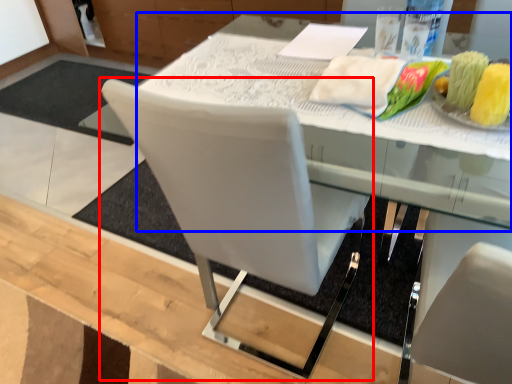
Question: Which of the following is the closest to the observer, chair (highlighted by a red box) or round table (highlighted by a blue box)?

Choices:
 (A) chair
 (B) round table

Answer: (A)